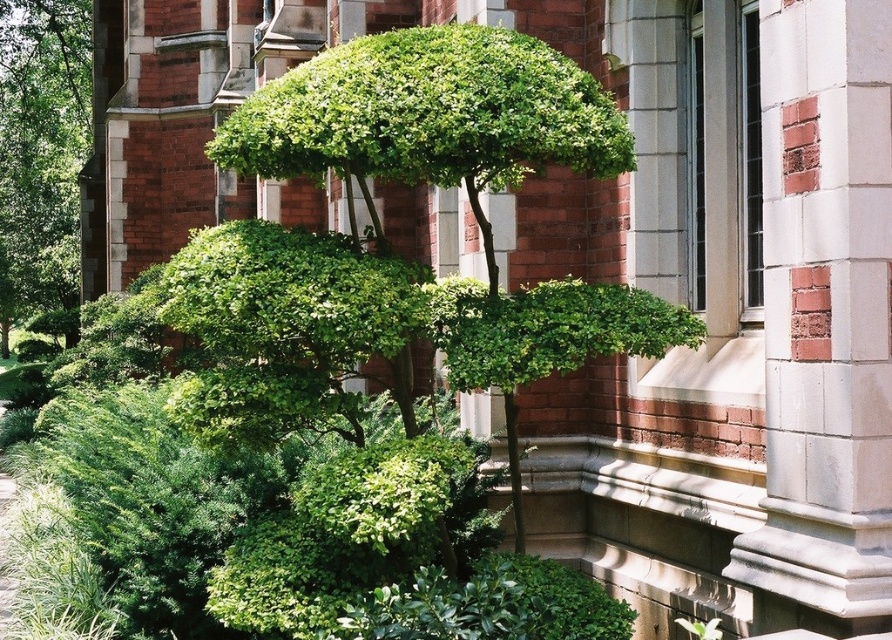
Which is more to the right, green leafy bush at center or green leafy bush at left?

Positioned to the right is green leafy bush at center.

Measure the distance between green leafy bush at center and green leafy bush at left.

A distance of 26.11 meters exists between green leafy bush at center and green leafy bush at left.

Between point (224, 346) and point (38, 209), which one is positioned behind?

Positioned behind is point (38, 209).

You are a GUI agent. You are given a task and a screenshot of the screen. Output one action in this format:
    pyautogui.click(x=<x>, y=<y>)
    Task: Click on the green leafy bush at center
    
    Given the screenshot: What is the action you would take?
    pyautogui.click(x=288, y=330)